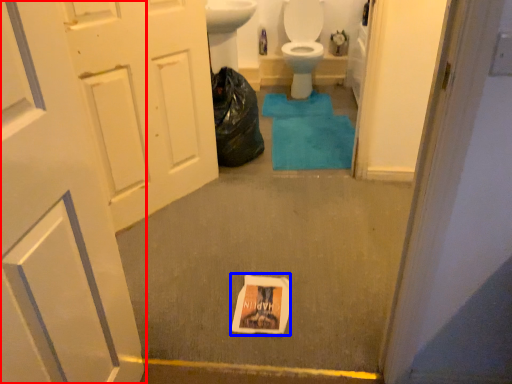
Question: Among these objects, which one is farthest to the camera, door (highlighted by a red box) or flyer (highlighted by a blue box)?

Choices:
 (A) door
 (B) flyer

Answer: (B)